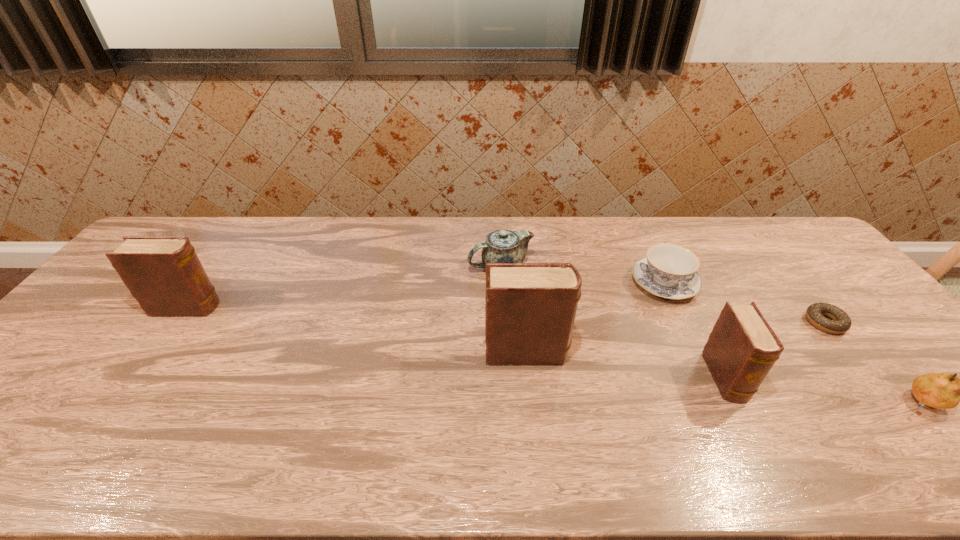
If equal spacing is desired by inserting an extra diary among them, please point out a free spot for this new diary. Please provide its 2D coordinates. Your answer should be formatted as a tuple, i.e. [(x, y)], where the tuple contains the x and y coordinates of a point satisfying the conditions above.

[(348, 328)]